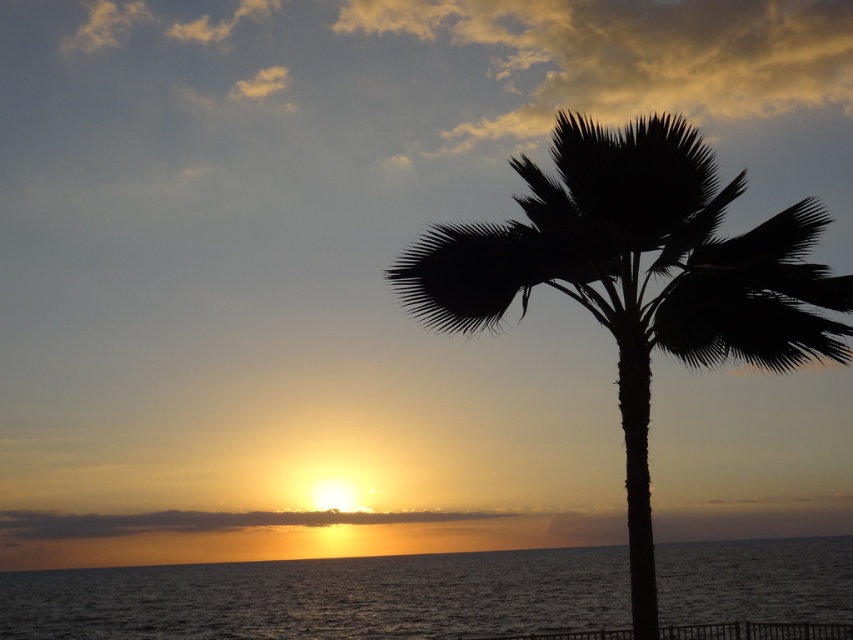
Who is higher up, black silhouette palm tree at center or silvery water at lower center?

black silhouette palm tree at center

Does black silhouette palm tree at center appear on the left side of silvery water at lower center?

Yes, black silhouette palm tree at center is to the left of silvery water at lower center.

Identify the location of black silhouette palm tree at center. (639, 276).

Where is `black silhouette palm tree at center`? The height and width of the screenshot is (640, 853). black silhouette palm tree at center is located at coordinates (639, 276).